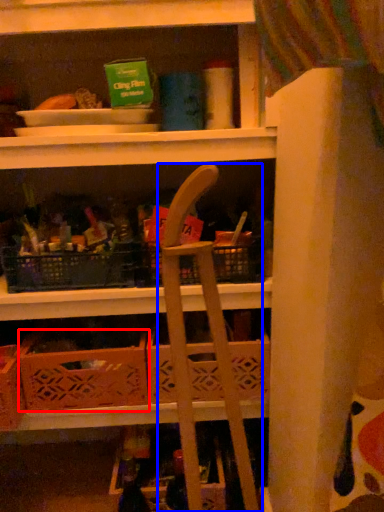
Question: Among these objects, which one is farthest to the camera, crate (highlighted by a red box) or folding chair (highlighted by a blue box)?

Choices:
 (A) crate
 (B) folding chair

Answer: (A)